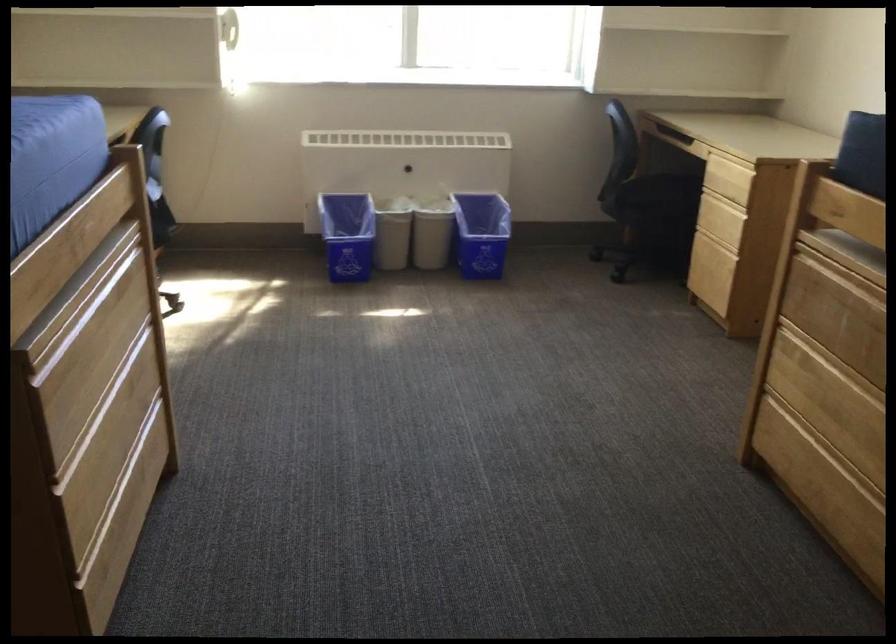
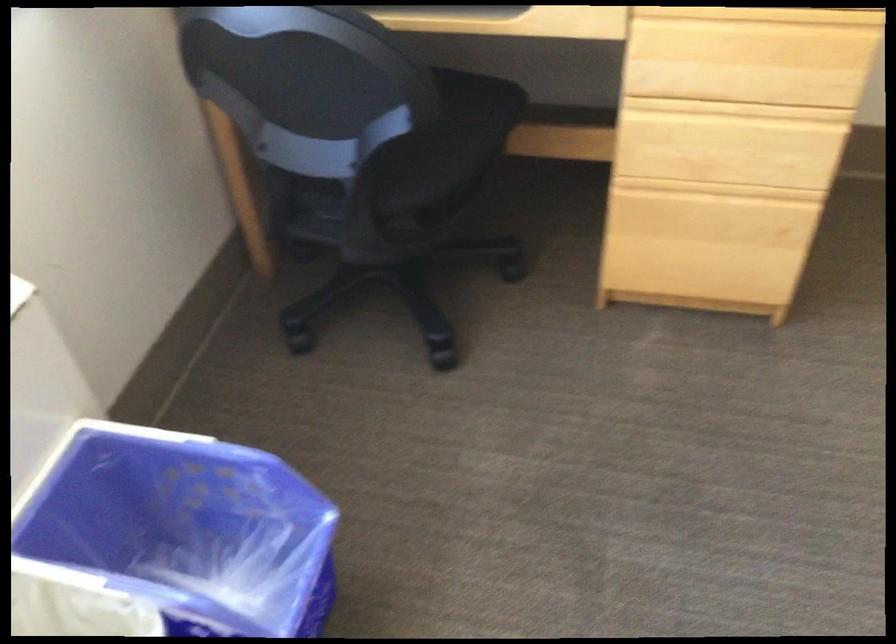
In the second image, find the point that corresponds to pixel 719 192 in the first image.

(736, 109)